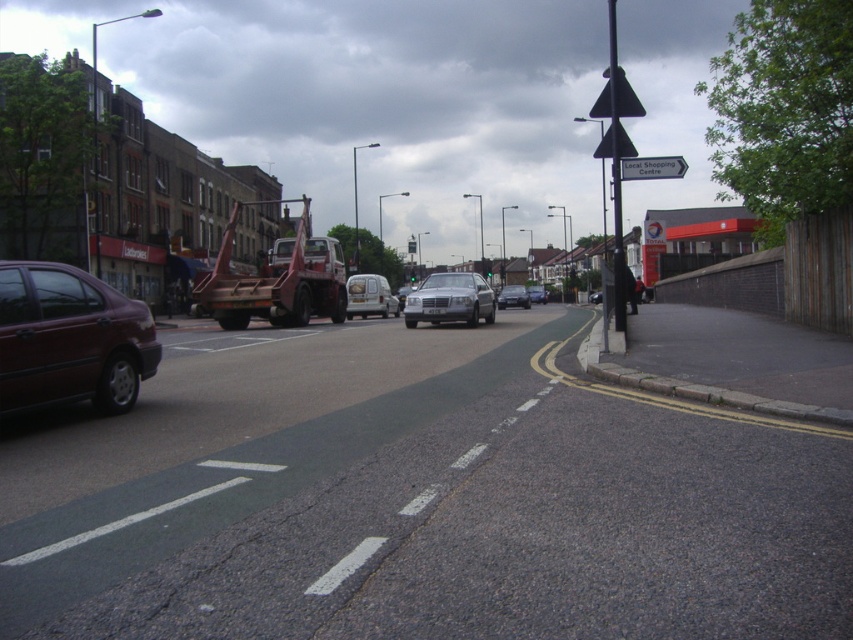
Question: Which object is closer to the camera taking this photo?

Choices:
 (A) satin silver car at center
 (B) white plastic sign at upper center

Answer: (B)

Question: Can you confirm if satin silver sedan at center is bigger than silver metallic sedan at center?

Choices:
 (A) yes
 (B) no

Answer: (A)

Question: Which object is closer to the camera taking this photo?

Choices:
 (A) matte maroon sedan at left
 (B) red matte tow truck at center

Answer: (A)

Question: In this image, where is matte maroon sedan at left located relative to white plastic sign at upper center?

Choices:
 (A) left
 (B) right

Answer: (A)

Question: Which is farther from the red matte tow truck at center?

Choices:
 (A) metallic silver van at center
 (B) satin silver sedan at center

Answer: (B)

Question: Can you confirm if metallic silver van at center is wider than silver metallic sedan at center?

Choices:
 (A) yes
 (B) no

Answer: (B)